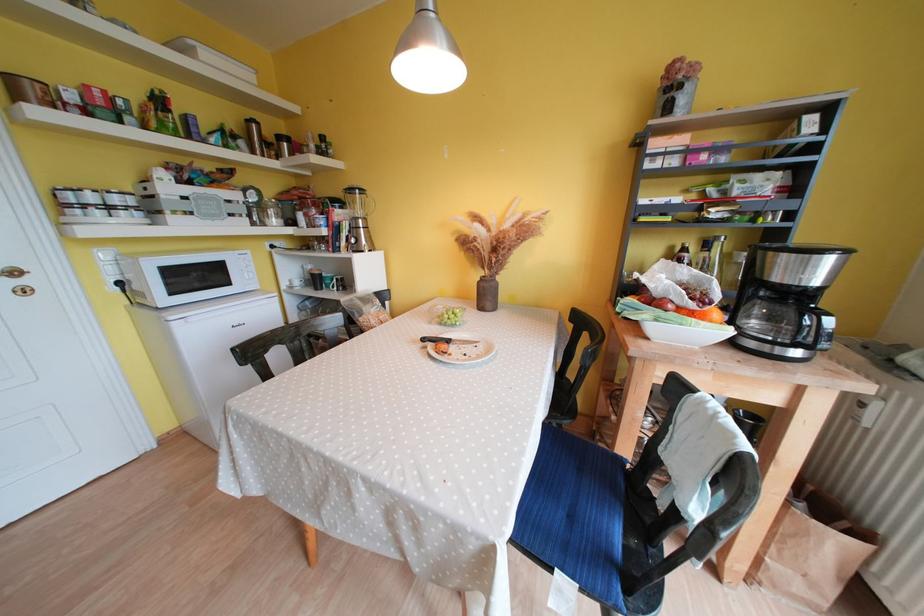
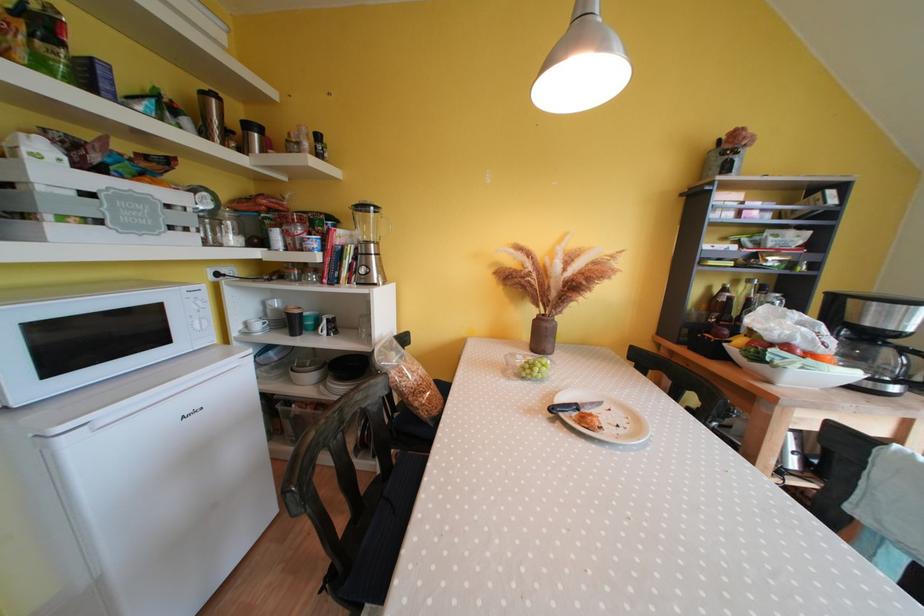
The point at (319, 278) is marked in the first image. Where is the corresponding point in the second image?

(296, 318)